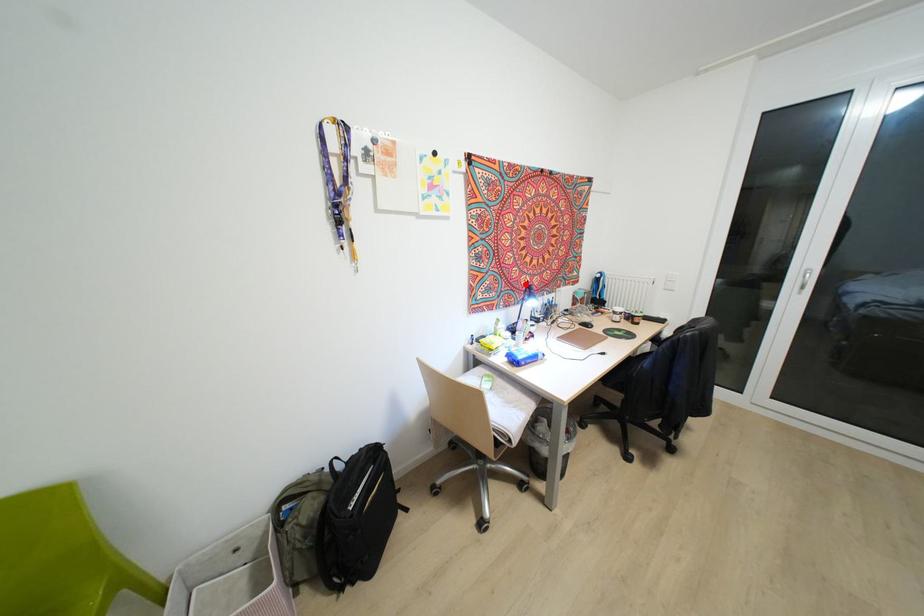
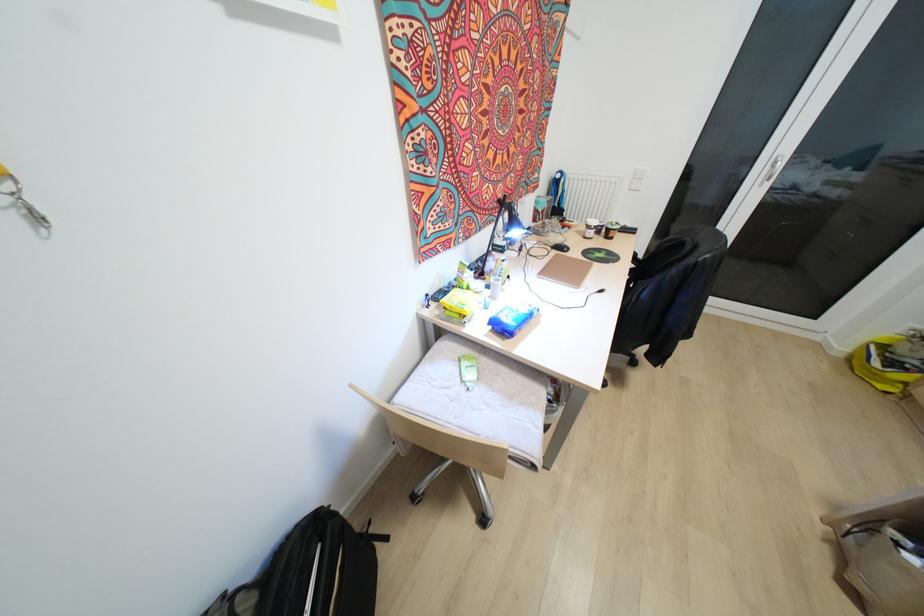
Find the pixel in the second image that matches the highlighted location in the first image.

(499, 201)